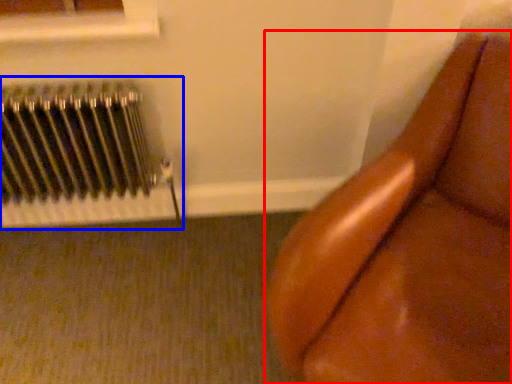
Question: Which point is closer to the camera, furniture (highlighted by a red box) or radiator (highlighted by a blue box)?

Choices:
 (A) furniture
 (B) radiator

Answer: (A)